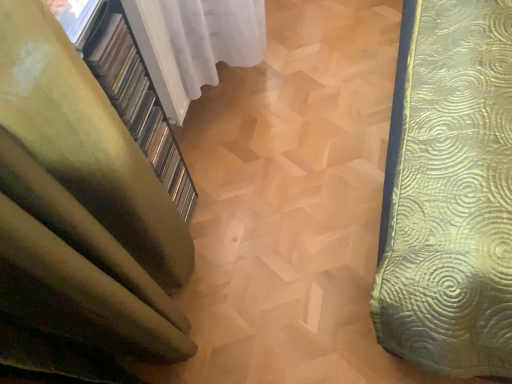
Question: From the image's perspective, is white sheer curtain at upper left, the 1th curtain when ordered from top to bottom, located above or below green fabric curtain at left, which appears as the 2th curtain when viewed from the top?

Choices:
 (A) below
 (B) above

Answer: (B)

Question: Relative to green fabric curtain at left, the 1th curtain in the bottom-to-top sequence, is white sheer curtain at upper left, the 1th curtain when ordered from top to bottom, in front or behind?

Choices:
 (A) front
 (B) behind

Answer: (B)

Question: Which object is the closest to the white sheer curtain at upper left, the 1th curtain when ordered from top to bottom?

Choices:
 (A) green fabric curtain at left, which appears as the 2th curtain when viewed from the top
 (B) transparent glass window at upper left

Answer: (B)

Question: Considering the real-world distances, which object is closest to the white sheer curtain at upper left, positioned as the second curtain in bottom-to-top order?

Choices:
 (A) transparent glass window at upper left
 (B) green fabric curtain at left, the 1th curtain in the bottom-to-top sequence

Answer: (A)